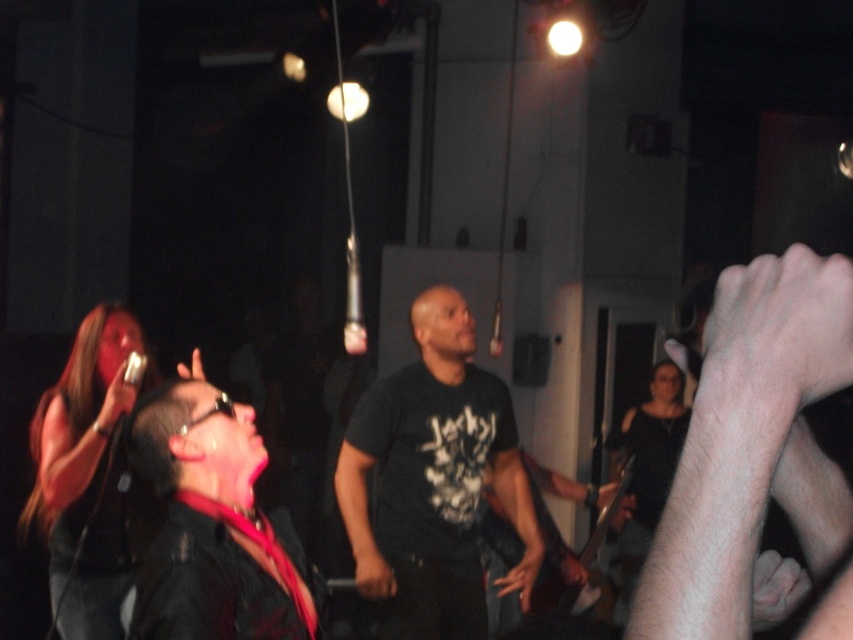
Measure the distance between black matte t-shirt at center and camera.

black matte t-shirt at center and camera are 3.88 meters apart.

Is black matte t-shirt at center taller than black leather jacket at lower left?

Yes, black matte t-shirt at center is taller than black leather jacket at lower left.

Measure the distance between point (x=451, y=417) and camera.

Point (x=451, y=417) is 4.14 meters away from camera.

The width and height of the screenshot is (853, 640). Identify the location of black matte t-shirt at center. (434, 481).